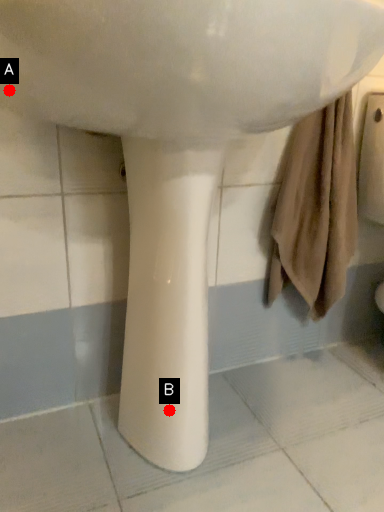
Question: Two points are circled on the image, labeled by A and B beside each circle. Among these points, which one is farthest from the camera?

Choices:
 (A) A is further
 (B) B is further

Answer: (B)